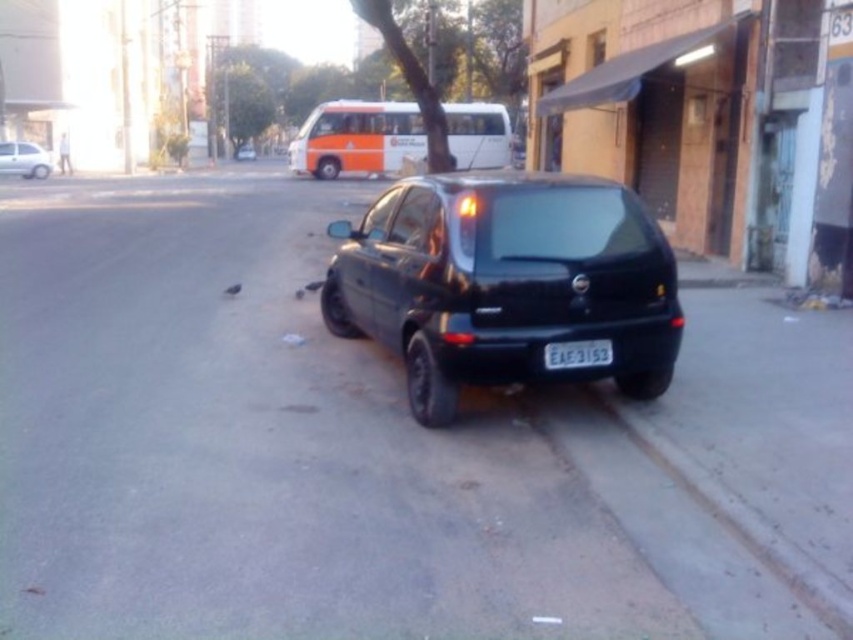
Can you confirm if orange/white bus at upper center is positioned above matte white car at left?

Indeed, orange/white bus at upper center is positioned over matte white car at left.

Is orange/white bus at upper center wider than matte white car at left?

Yes.

Where is `orange/white bus at upper center`? orange/white bus at upper center is located at coordinates (357, 138).

Is black glossy hatchback at center shorter than matte white car at left?

In fact, black glossy hatchback at center may be taller than matte white car at left.

Can you confirm if black glossy hatchback at center is taller than matte white car at left?

Indeed, black glossy hatchback at center has a greater height compared to matte white car at left.

Which is behind, point (483, 292) or point (28, 147)?

Positioned behind is point (28, 147).

Locate an element on the screen. The width and height of the screenshot is (853, 640). black glossy hatchback at center is located at coordinates (505, 282).

Can you confirm if orange/white bus at upper center is positioned below black plastic license plate at rear?

No, orange/white bus at upper center is not below black plastic license plate at rear.

Does point (407, 100) come behind point (585, 362)?

Yes, point (407, 100) is behind point (585, 362).

Where is `orange/white bus at upper center`? orange/white bus at upper center is located at coordinates (357, 138).